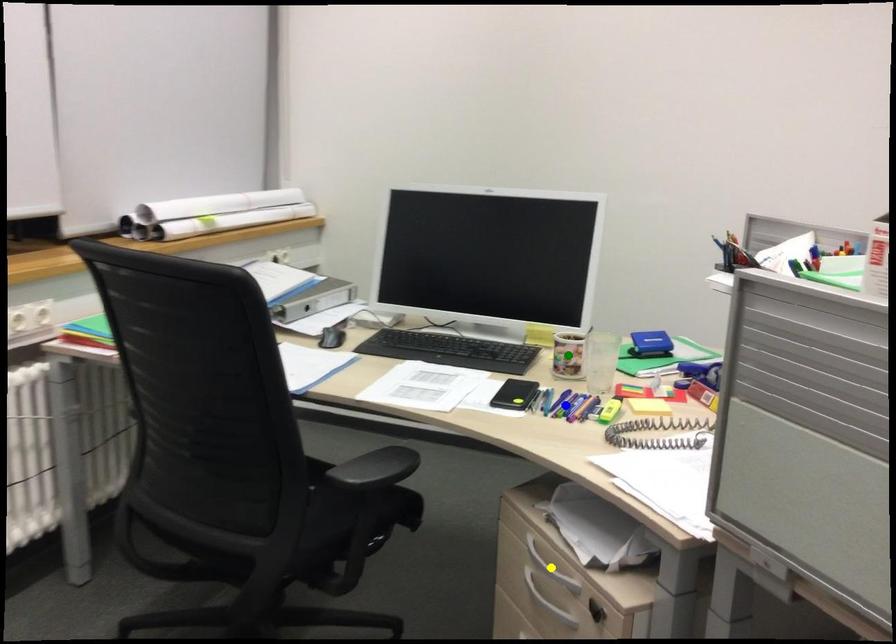
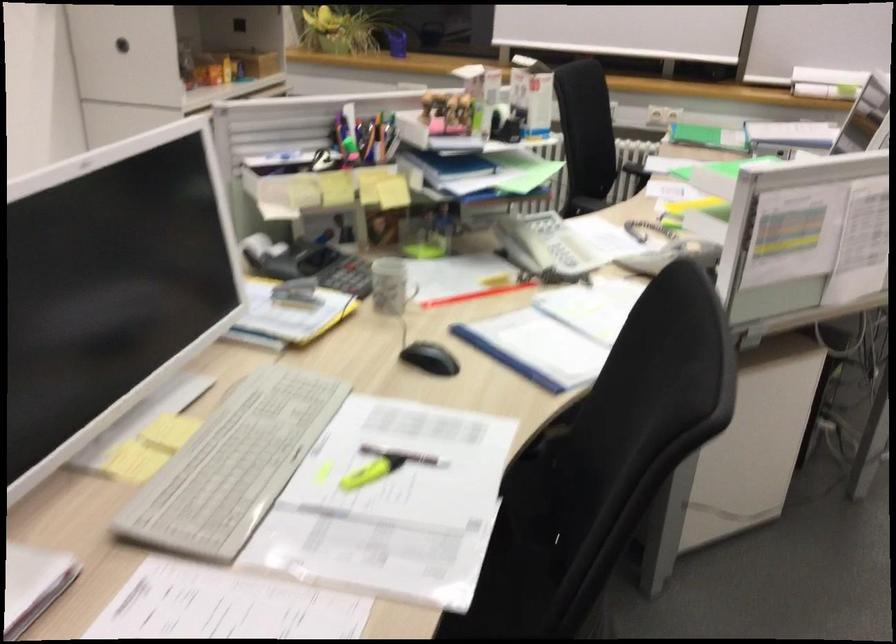
I am providing you with two images of the same scene from different viewpoints. Three points are marked in image1. Which point corresponds to a part or object that is occluded in image2?In image1, three points are marked. Which of them correspond to a part or object that is occluded in image2?Among the three points shown in image1, which one corresponds to a part or object that is no longer visible due to occlusion in image2?

blue point, yellow point, green point cannot be seen in image2.